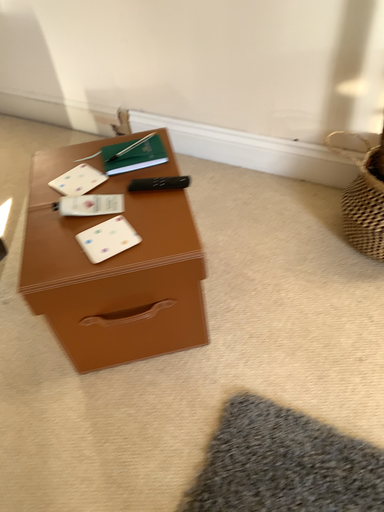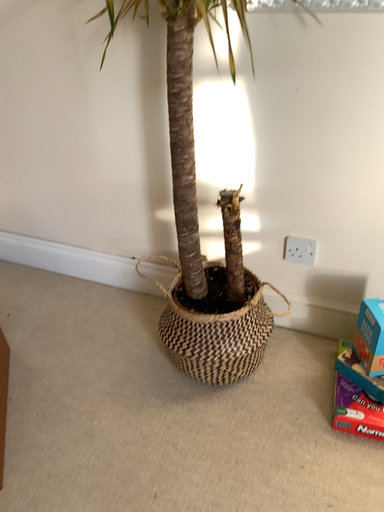
Question: Which way did the camera rotate in the video?

Choices:
 (A) rotated upward
 (B) rotated downward

Answer: (A)